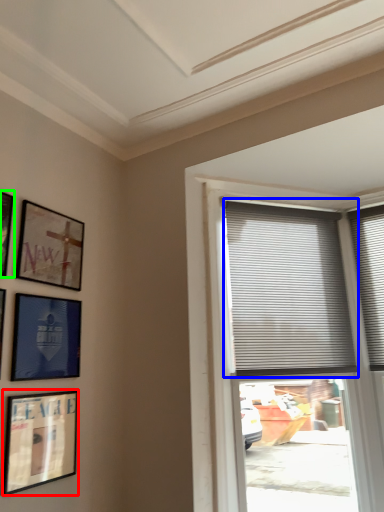
Question: Which is nearer to the picture frame (highlighted by a red box)? window blind (highlighted by a blue box) or picture frame (highlighted by a green box).

Choices:
 (A) window blind
 (B) picture frame

Answer: (B)